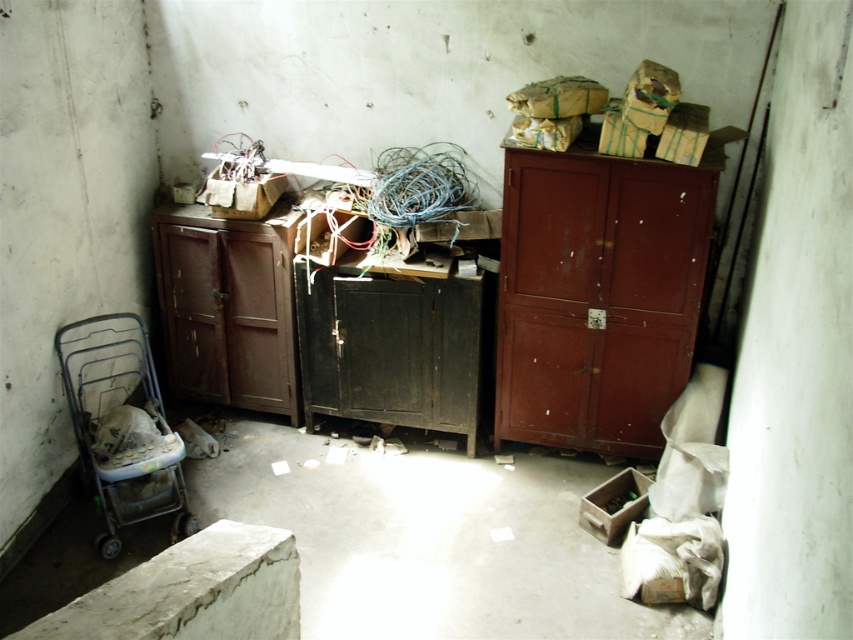
Question: Which of these objects is positioned farthest from the metallic wireframe stroller at lower left?

Choices:
 (A) matte brown cabinet at center
 (B) matte wood cabinet at right

Answer: (B)

Question: Which of the following is the farthest from the observer?

Choices:
 (A) (637, 337)
 (B) (113, 448)
 (C) (276, 275)

Answer: (C)

Question: Which object is the farthest from the matte wood cabinet at right?

Choices:
 (A) metallic wireframe stroller at lower left
 (B) matte brown cabinet at center

Answer: (A)

Question: Does matte wood cabinet at right appear on the right side of metallic wireframe stroller at lower left?

Choices:
 (A) yes
 (B) no

Answer: (A)

Question: Is matte brown cabinet at center thinner than metallic wireframe stroller at lower left?

Choices:
 (A) no
 (B) yes

Answer: (A)

Question: Is matte wood cabinet at right closer to camera compared to matte brown cabinet at center?

Choices:
 (A) yes
 (B) no

Answer: (A)